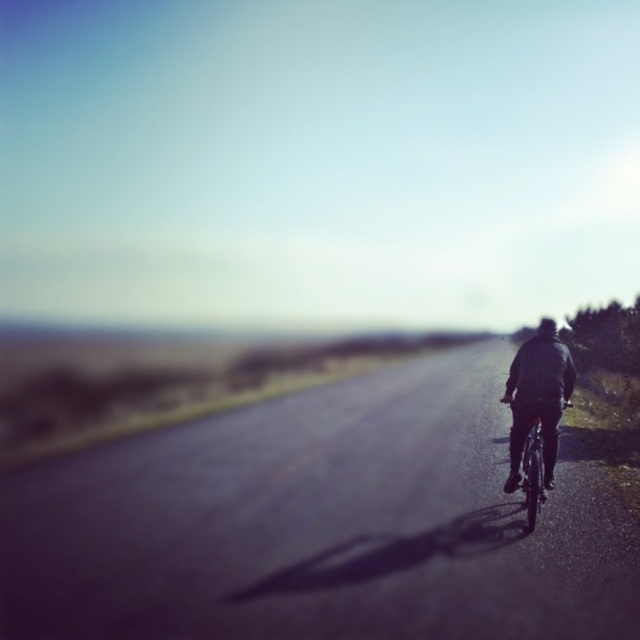
Who is shorter, dark gray jacket at right or metallic silver bicycle at center?

metallic silver bicycle at center is shorter.

Does dark gray jacket at right have a greater width compared to metallic silver bicycle at center?

Yes.

Between point (513, 392) and point (536, 467), which one is positioned behind?

The point (513, 392) is more distant.

You are a GUI agent. You are given a task and a screenshot of the screen. Output one action in this format:
    pyautogui.click(x=<x>, y=<y>)
    Task: Click on the dark gray jacket at right
    
    Given the screenshot: What is the action you would take?
    pyautogui.click(x=538, y=397)